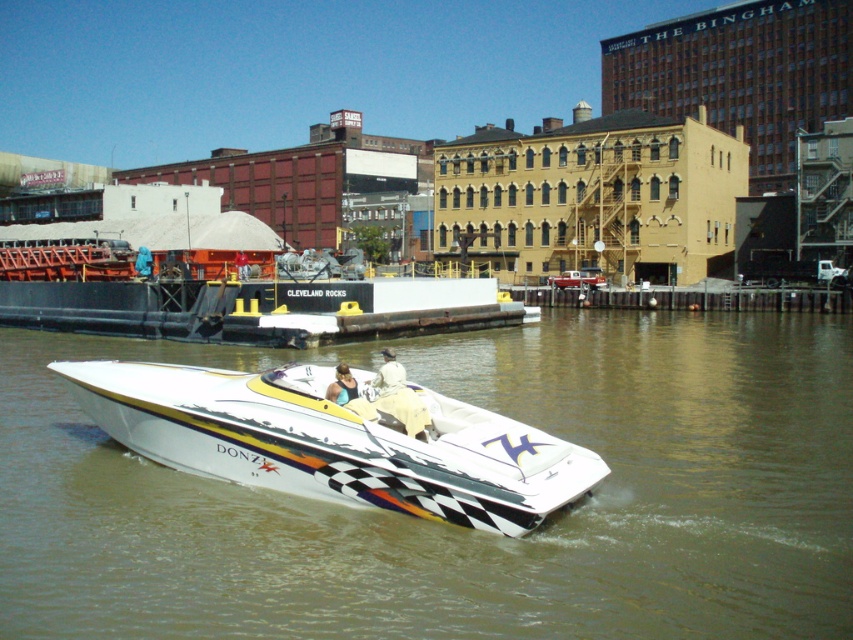
You are a photographer trying to capture the white glossy speedboat at center. You notice the white glossy water at center might block your view. Based on the scene, can you determine if the water is in front of or behind the boat?

Answer: The white glossy water at center is in front of the white glossy speedboat at center, so it may block the view of the boat.